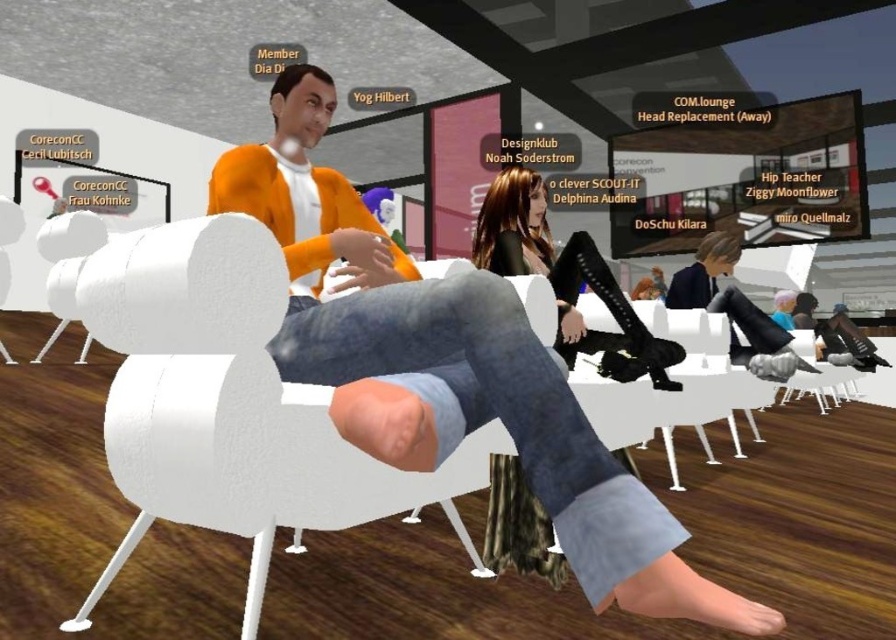
You are an avatar in this virtual environment and want to determine which piece of clothing is higher up between the orange cotton sweater at center and the shiny black leggings at center. Which one is taller?

The orange cotton sweater at center is much taller than the shiny black leggings at center.

You are an avatar in a virtual meeting. You want to move from your current position to the white matte chair at center. There is an orange cotton sweater at center in the way. Can you walk around it without getting too close? The minimum safe distance required is 12 inches.

The distance between the orange cotton sweater at center and the white matte chair at center is 11.48 inches. Since the minimum safe distance required is 12 inches, you cannot walk around the orange cotton sweater at center without getting too close.

You are designing a virtual space and need to ensure that the orange cotton sweater at center and the white matte chair at center are proportionate to each other. Based on the scene description, which object should be scaled down to achieve a more balanced appearance?

The orange cotton sweater at center is larger in size than the white matte chair at center. To achieve a more balanced appearance, the orange cotton sweater at center should be scaled down to match the size of the white matte chair at center.